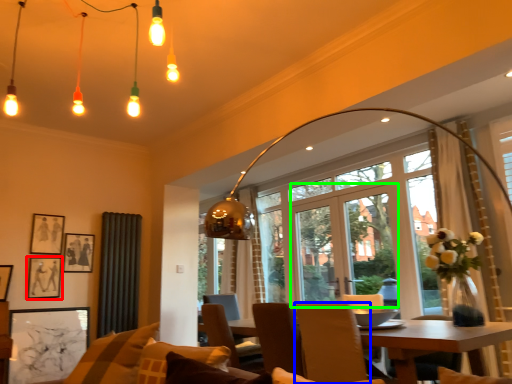
Question: Which object is the closest to the picture frame (highlighted by a red box)? Choose among these: chair (highlighted by a blue box) or screen door (highlighted by a green box).

Choices:
 (A) chair
 (B) screen door

Answer: (A)